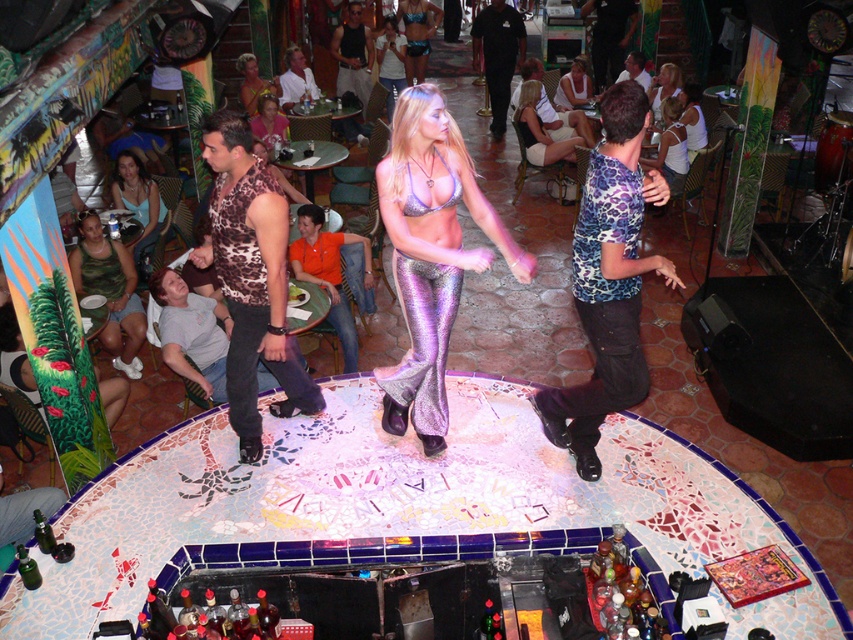
Who is shorter, shiny blue bikini at center or matte pink blouse at center?

matte pink blouse at center

Can you confirm if shiny blue bikini at center is bigger than matte pink blouse at center?

Yes, shiny blue bikini at center is bigger than matte pink blouse at center.

This screenshot has height=640, width=853. What are the coordinates of `shiny blue bikini at center` in the screenshot? It's located at (416, 35).

Does point (323, 241) come in front of point (293, 72)?

Yes, it is in front of point (293, 72).

Where is `orange shirt at center`? This screenshot has height=640, width=853. orange shirt at center is located at coordinates (329, 273).

Who is more distant from viewer, (433,381) or (289,49)?

Positioned behind is point (289,49).

Is point (450, 122) in front of point (305, 68)?

Yes, it is.

Is point (393, 260) positioned after point (312, 86)?

No, it is not.

This screenshot has width=853, height=640. What are the coordinates of `shiny metallic pants at center` in the screenshot? It's located at (430, 253).